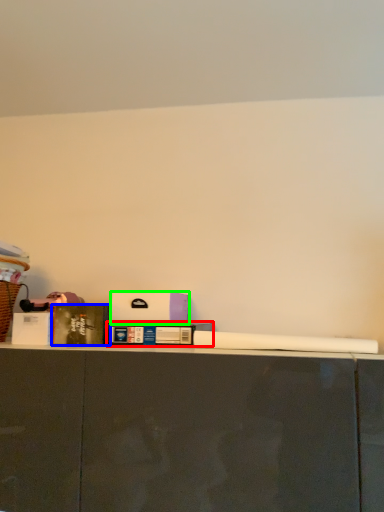
Question: Which is farther away from book (highlighted by a red box)? book (highlighted by a blue box) or box (highlighted by a green box)?

Choices:
 (A) book
 (B) box

Answer: (A)